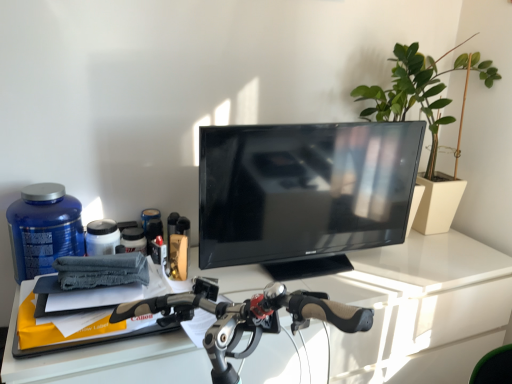
Question: Does black glossy tv at center have a larger size compared to white glossy desk at center?

Choices:
 (A) no
 (B) yes

Answer: (A)

Question: Considering the relative sizes of black glossy tv at center and white glossy desk at center in the image provided, is black glossy tv at center smaller than white glossy desk at center?

Choices:
 (A) yes
 (B) no

Answer: (A)

Question: Considering the relative positions of black glossy tv at center and white glossy desk at center in the image provided, is black glossy tv at center to the right of white glossy desk at center from the viewer's perspective?

Choices:
 (A) yes
 (B) no

Answer: (A)

Question: Is the position of black glossy tv at center more distant than that of white glossy desk at center?

Choices:
 (A) yes
 (B) no

Answer: (A)

Question: From the image's perspective, is black glossy tv at center located above white glossy desk at center?

Choices:
 (A) yes
 (B) no

Answer: (A)

Question: Can you confirm if black glossy tv at center is thinner than white glossy desk at center?

Choices:
 (A) yes
 (B) no

Answer: (A)

Question: From a real-world perspective, does black glossy tv at center stand above blue matte bottle at left?

Choices:
 (A) yes
 (B) no

Answer: (A)

Question: Does black glossy tv at center have a larger size compared to blue matte bottle at left?

Choices:
 (A) yes
 (B) no

Answer: (A)

Question: Could blue matte bottle at left be considered to be inside black glossy tv at center?

Choices:
 (A) no
 (B) yes

Answer: (A)

Question: Is the depth of black glossy tv at center less than that of blue matte bottle at left?

Choices:
 (A) yes
 (B) no

Answer: (B)

Question: Would you say black glossy tv at center is a long distance from blue matte bottle at left?

Choices:
 (A) no
 (B) yes

Answer: (A)

Question: Can we say black glossy tv at center lies outside blue matte bottle at left?

Choices:
 (A) no
 (B) yes

Answer: (B)

Question: Can you confirm if white glossy desk at center is wider than green matte plant at upper right?

Choices:
 (A) no
 (B) yes

Answer: (B)